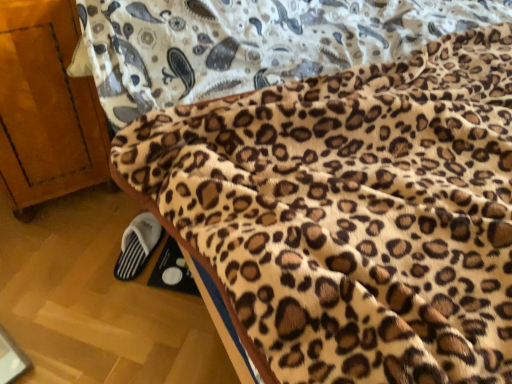
Where is `free space to the right of white fabric slipper at lower left`? The image size is (512, 384). free space to the right of white fabric slipper at lower left is located at coordinates (167, 261).